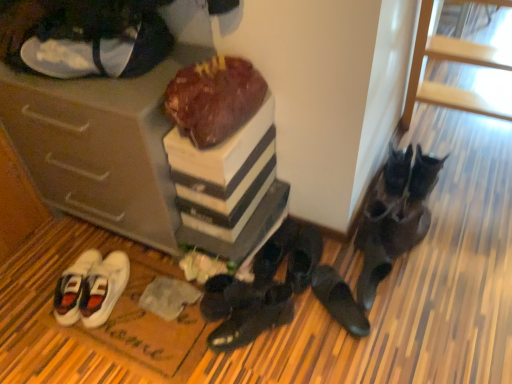
Question: From the image's perspective, would you say black leather shoes at lower right, acting as the 2th footwear starting from the right, is shown under white canvas sneakers at upper left, which appears as the second footwear when viewed from the left?

Choices:
 (A) yes
 (B) no

Answer: (A)

Question: Is white canvas sneakers at upper left, the 6th footwear positioned from the right, a part of black leather shoes at lower right, acting as the 2th footwear starting from the right?

Choices:
 (A) no
 (B) yes

Answer: (A)

Question: From the image's perspective, is black leather shoes at lower right, acting as the 2th footwear starting from the right, over white canvas sneakers at upper left, the 6th footwear positioned from the right?

Choices:
 (A) yes
 (B) no

Answer: (B)

Question: Can you confirm if black leather shoes at lower right, acting as the 2th footwear starting from the right, is bigger than white canvas sneakers at upper left, which appears as the second footwear when viewed from the left?

Choices:
 (A) no
 (B) yes

Answer: (A)

Question: Is black leather shoes at lower right, acting as the 2th footwear starting from the right, shorter than white canvas sneakers at upper left, the 6th footwear positioned from the right?

Choices:
 (A) no
 (B) yes

Answer: (B)

Question: From a real-world perspective, is black leather shoes at lower right, which is the 6th footwear in left-to-right order, over white canvas sneakers at upper left, the 6th footwear positioned from the right?

Choices:
 (A) no
 (B) yes

Answer: (A)

Question: Can you confirm if matte brown cabinet at lower left is thinner than white canvas sneakers at lower left, which appears as the 7th footwear when viewed from the right?

Choices:
 (A) no
 (B) yes

Answer: (A)

Question: Is matte brown cabinet at lower left outside of white canvas sneakers at lower left, the first footwear in the left-to-right sequence?

Choices:
 (A) no
 (B) yes

Answer: (B)

Question: From a real-world perspective, does matte brown cabinet at lower left stand above white canvas sneakers at lower left, which appears as the 7th footwear when viewed from the right?

Choices:
 (A) no
 (B) yes

Answer: (B)

Question: Does matte brown cabinet at lower left have a smaller size compared to white canvas sneakers at lower left, the first footwear in the left-to-right sequence?

Choices:
 (A) no
 (B) yes

Answer: (A)

Question: From the image's perspective, is matte brown cabinet at lower left above white canvas sneakers at lower left, the first footwear in the left-to-right sequence?

Choices:
 (A) no
 (B) yes

Answer: (B)

Question: Is matte brown cabinet at lower left wider than white canvas sneakers at lower left, which appears as the 7th footwear when viewed from the right?

Choices:
 (A) yes
 (B) no

Answer: (A)

Question: From the image's perspective, is white canvas sneakers at lower left, which appears as the 7th footwear when viewed from the right, on black suede shoes at center, which is counted as the fifth footwear, starting from the right?

Choices:
 (A) no
 (B) yes

Answer: (B)